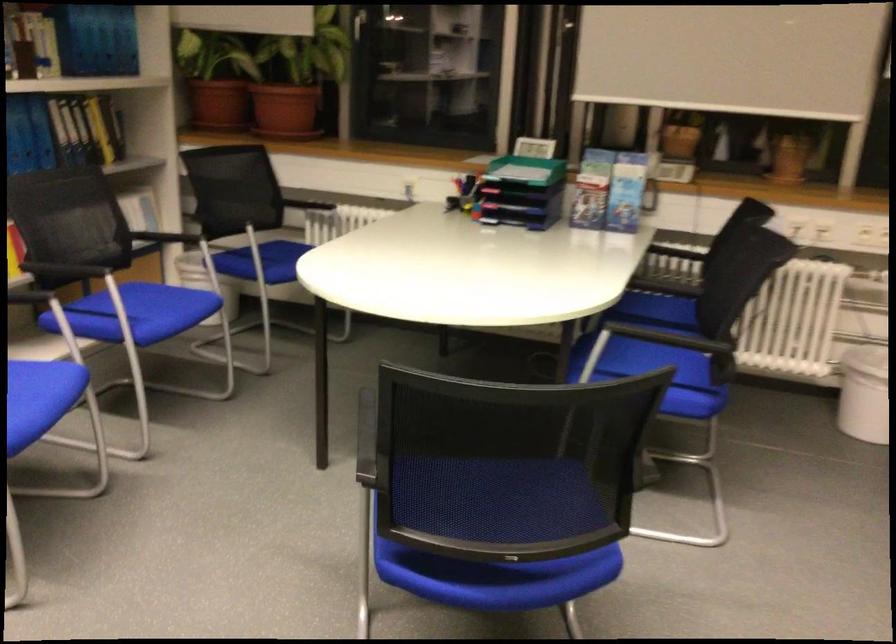
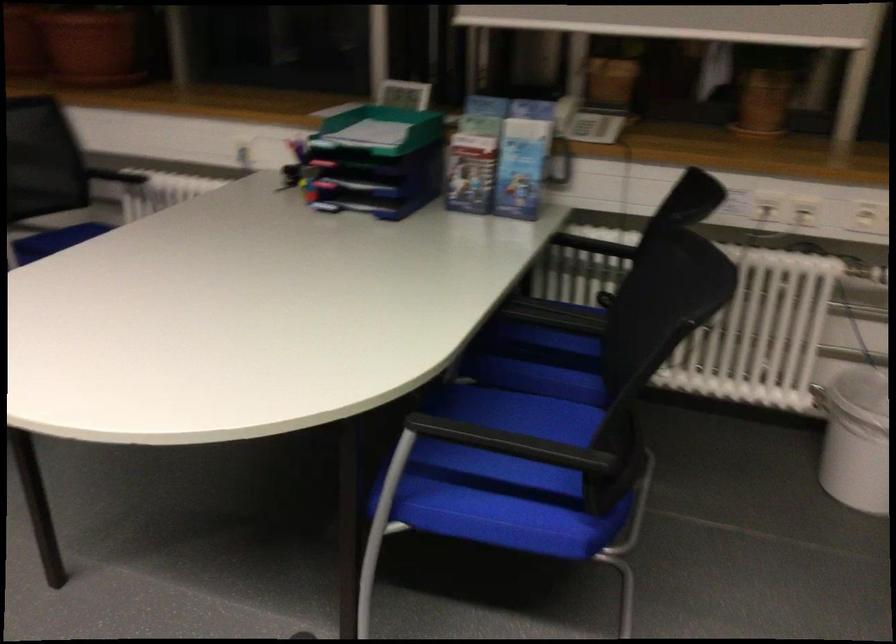
Which direction would the cameraman need to move to produce the second image?

The cameraman walked toward right, forward.